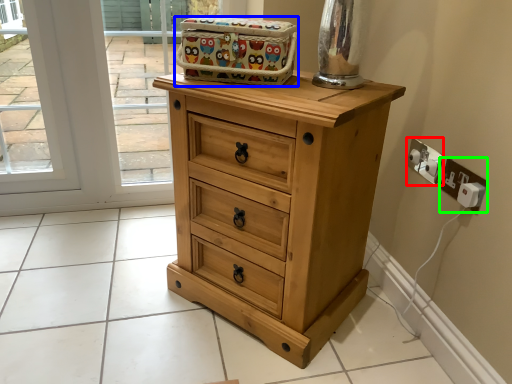
Question: Based on their relative distances, which object is nearer to electric outlet (highlighted by a red box)? Choose from crate (highlighted by a blue box) and electric outlet (highlighted by a green box).

Choices:
 (A) crate
 (B) electric outlet

Answer: (B)